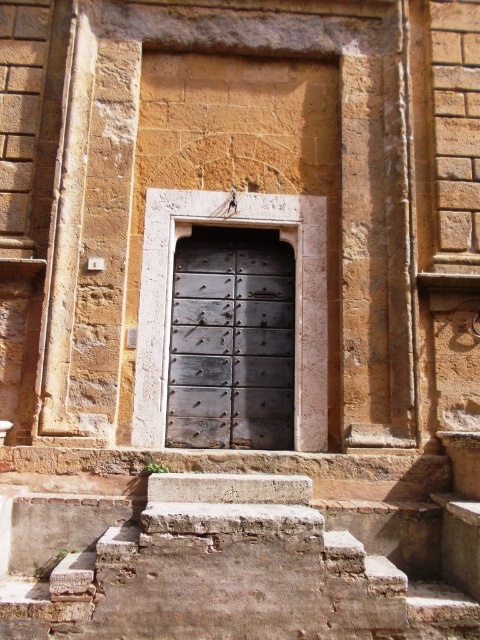
Question: Is rusty stone stairs at lower center positioned in front of rusty metal door at center?

Choices:
 (A) yes
 (B) no

Answer: (A)

Question: Where is rusty stone stairs at lower center located in relation to rusty metal door at center in the image?

Choices:
 (A) above
 (B) below

Answer: (B)

Question: Considering the relative positions of rusty stone stairs at lower center and rusty metal door at center in the image provided, where is rusty stone stairs at lower center located with respect to rusty metal door at center?

Choices:
 (A) below
 (B) above

Answer: (A)

Question: Among these objects, which one is farthest from the camera?

Choices:
 (A) rusty stone stairs at lower center
 (B) rusty metal door at center

Answer: (B)